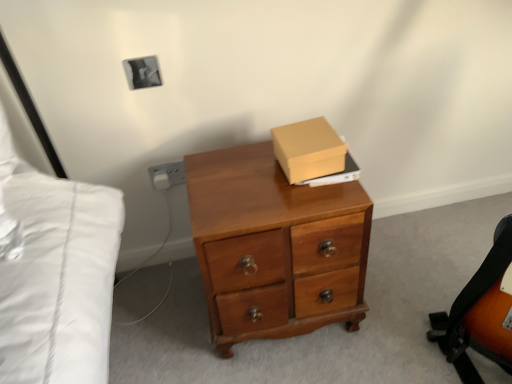
Identify the location of free space to the right of wooden desk at center. The height and width of the screenshot is (384, 512). (402, 276).